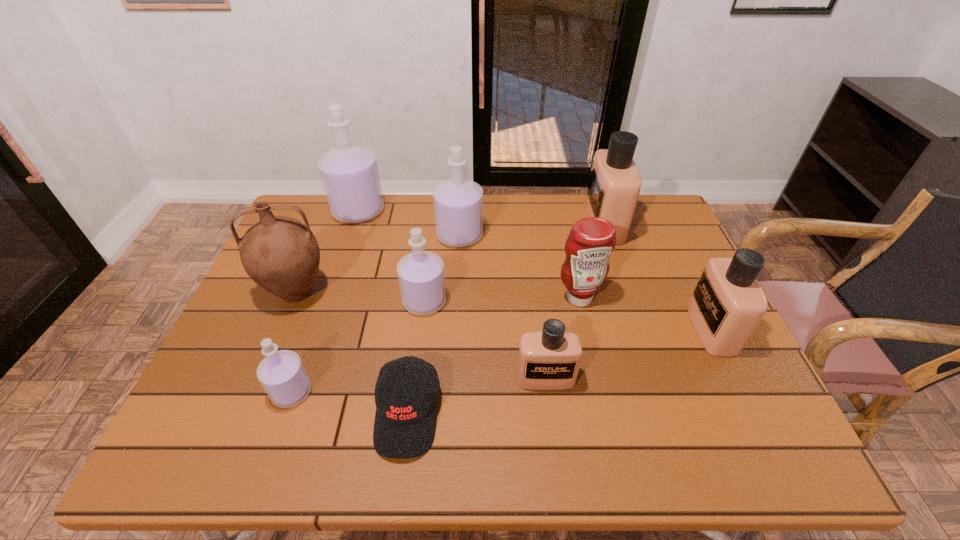
The width and height of the screenshot is (960, 540). I want to click on the nearest purple perfume, so click(x=282, y=374).

The height and width of the screenshot is (540, 960). Identify the location of the leftmost beige perfume. (550, 359).

Find the location of `the smallest beige perfume`. the smallest beige perfume is located at coordinates (550, 359).

Find the location of `the shortest object`. the shortest object is located at coordinates (404, 427).

The width and height of the screenshot is (960, 540). Find the location of `black baseball cap`. black baseball cap is located at coordinates (404, 427).

Image resolution: width=960 pixels, height=540 pixels. I want to click on free space located 0.140m on the front of the tallest perfume, so click(344, 256).

This screenshot has height=540, width=960. Find the location of `vacant space located on the front label of the biggest beige perfume`. vacant space located on the front label of the biggest beige perfume is located at coordinates (493, 224).

Locate an element on the screen. Image resolution: width=960 pixels, height=540 pixels. vacant area situated on the front label of the biggest beige perfume is located at coordinates (497, 224).

You are a GUI agent. You are given a task and a screenshot of the screen. Output one action in this format:
    pyautogui.click(x=<x>, y=<y>)
    Task: Click on the free location located on the front label of the biggest beige perfume
    
    Given the screenshot: What is the action you would take?
    pyautogui.click(x=522, y=224)

You are a GUI agent. You are given a task and a screenshot of the screen. Output one action in this format:
    pyautogui.click(x=<x>, y=<y>)
    Task: Click on the free region located on the front of the second biggest purple perfume
    This screenshot has height=540, width=960.
    Given the screenshot: What is the action you would take?
    pyautogui.click(x=454, y=334)